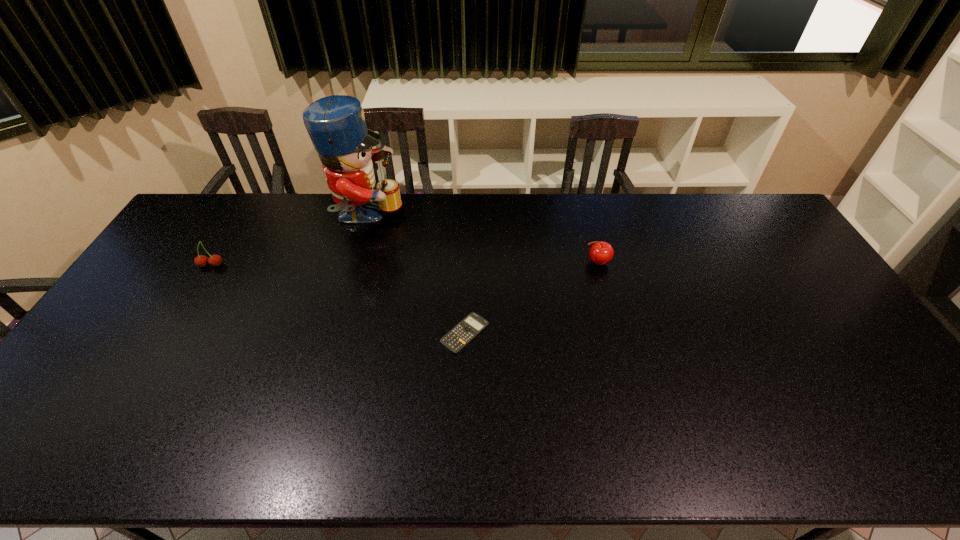
Identify the location of object that is at the far edge. The height and width of the screenshot is (540, 960). click(x=336, y=124).

The height and width of the screenshot is (540, 960). Identify the location of object that is at the left edge. (215, 260).

The image size is (960, 540). In order to click on free region at the far edge of the desktop in this screenshot , I will do `click(628, 201)`.

You are a GUI agent. You are given a task and a screenshot of the screen. Output one action in this format:
    pyautogui.click(x=<x>, y=<y>)
    Task: Click on the blank space at the near edge of the desktop
    The width and height of the screenshot is (960, 540).
    Given the screenshot: What is the action you would take?
    pyautogui.click(x=803, y=437)

Locate an element on the screen. The height and width of the screenshot is (540, 960). vacant position at the left edge of the desktop is located at coordinates (140, 354).

Where is `free space at the right edge of the desktop`? This screenshot has height=540, width=960. free space at the right edge of the desktop is located at coordinates (780, 282).

This screenshot has height=540, width=960. What are the coordinates of `vacant space at the far left corner of the desktop` in the screenshot? It's located at (212, 215).

Locate an element on the screen. vacant space at the near right corner of the desktop is located at coordinates (951, 464).

What are the coordinates of `vacant area that lies between the nearest object and the nutcracker` in the screenshot? It's located at (416, 275).

The image size is (960, 540). I want to click on vacant region between the shortest object and the right cherry, so click(x=531, y=298).